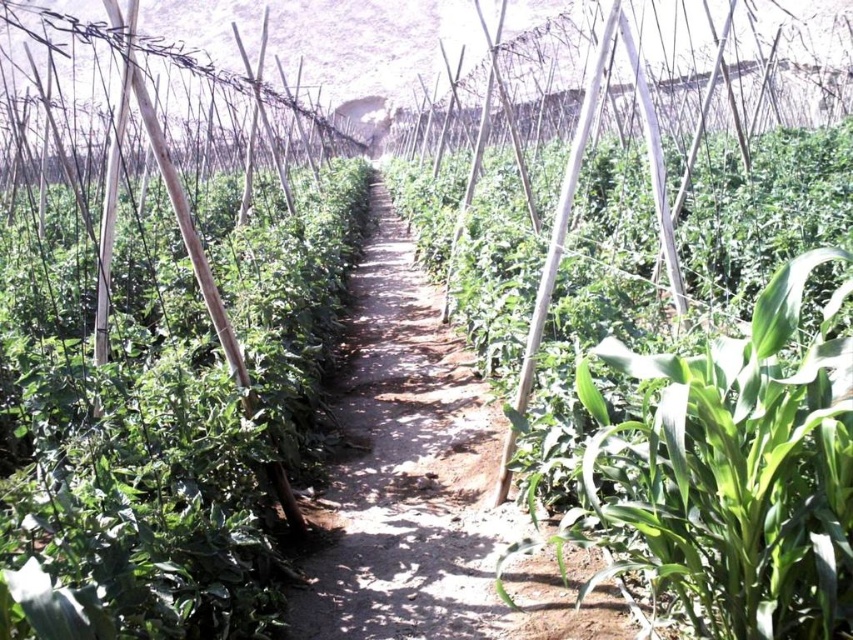
You are standing at the entrance of the greenhouse and see two points marked in the field. The first point is at coordinate point (x=723, y=538), and the second is at point (x=396, y=557). Which point is closer to you?

Point (x=723, y=538) is closer to the viewer than point (x=396, y=557).

You are standing at the entrance of the greenhouse and want to reach the green leafy plant at center. According to the coordinates provided, what are the x and y values indicating its position?

The green leafy plant at center is located at point with x value 0.741 and y value 0.850.